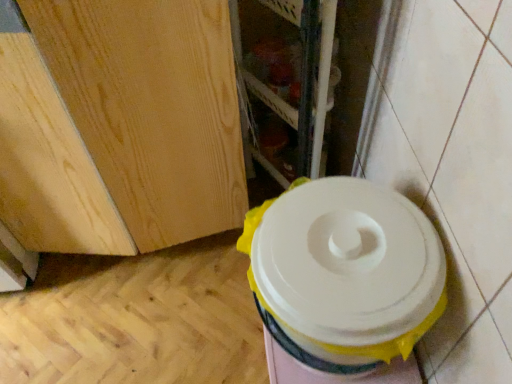
At what (x,y) coordinates should I click in order to perform the action: click on white plastic toilet at lower right. Please return your answer as a coordinate pair (x, y). Image resolution: width=512 pixels, height=384 pixels. Looking at the image, I should click on (343, 282).

What do you see at coordinates (343, 282) in the screenshot?
I see `white plastic toilet at lower right` at bounding box center [343, 282].

Find the location of `wooden shelf at center`. wooden shelf at center is located at coordinates (286, 77).

Measure the distance between point (317,72) and camera.

Point (317,72) and camera are 31.42 inches apart from each other.

This screenshot has width=512, height=384. What do you see at coordinates (286, 77) in the screenshot?
I see `wooden shelf at center` at bounding box center [286, 77].

The image size is (512, 384). I want to click on white plastic toilet at lower right, so click(x=343, y=282).

Does wooden shelf at center appear on the right side of white plastic toilet at lower right?

No, wooden shelf at center is not to the right of white plastic toilet at lower right.

From the picture: Is wooden shelf at center further to camera compared to white plastic toilet at lower right?

Yes, the depth of wooden shelf at center is greater than that of white plastic toilet at lower right.

Which point is more distant from viewer, (283, 124) or (406, 252)?

The point (283, 124) is more distant.

From the image's perspective, is wooden shelf at center above white plastic toilet at lower right?

Yes, from the image's perspective, wooden shelf at center is above white plastic toilet at lower right.

From a real-world perspective, is wooden shelf at center physically located above or below white plastic toilet at lower right?

wooden shelf at center is situated lower than white plastic toilet at lower right in the real world.

Does wooden shelf at center have a lesser width compared to white plastic toilet at lower right?

Indeed, wooden shelf at center has a lesser width compared to white plastic toilet at lower right.

Does wooden shelf at center have a lesser height compared to white plastic toilet at lower right?

No.

Considering the relative sizes of wooden shelf at center and white plastic toilet at lower right in the image provided, is wooden shelf at center bigger than white plastic toilet at lower right?

Yes.

From the picture: Is white plastic toilet at lower right completely or partially inside wooden shelf at center?

No, white plastic toilet at lower right is not inside wooden shelf at center.

Is there a large distance between wooden shelf at center and white plastic toilet at lower right?

No, there isn't a large distance between wooden shelf at center and white plastic toilet at lower right.

Is wooden shelf at center oriented towards white plastic toilet at lower right?

No, wooden shelf at center is not facing towards white plastic toilet at lower right.

The width and height of the screenshot is (512, 384). What are the coordinates of `shelf that appears behind the white plastic toilet at lower right` in the screenshot? It's located at (286, 77).

Which is more to the left, white plastic toilet at lower right or wooden shelf at center?

wooden shelf at center is more to the left.

Considering the positions of objects white plastic toilet at lower right and wooden shelf at center in the image provided, who is behind, white plastic toilet at lower right or wooden shelf at center?

Positioned behind is wooden shelf at center.

Is point (340, 181) less distant than point (303, 42)?

Yes, it is.

From the image's perspective, relative to wooden shelf at center, is white plastic toilet at lower right above or below?

Clearly, from the image's perspective, white plastic toilet at lower right is below wooden shelf at center.

From a real-world perspective, is white plastic toilet at lower right above or below wooden shelf at center?

Clearly, from a real-world perspective, white plastic toilet at lower right is above wooden shelf at center.

Consider the image. Considering the sizes of objects white plastic toilet at lower right and wooden shelf at center in the image provided, who is wider, white plastic toilet at lower right or wooden shelf at center?

Wider between the two is white plastic toilet at lower right.

Is white plastic toilet at lower right taller or shorter than wooden shelf at center?

In the image, white plastic toilet at lower right appears to be shorter than wooden shelf at center.

Is white plastic toilet at lower right bigger than wooden shelf at center?

Actually, white plastic toilet at lower right might be smaller than wooden shelf at center.

Is white plastic toilet at lower right spatially inside wooden shelf at center, or outside of it?

white plastic toilet at lower right is not enclosed by wooden shelf at center.

Would you say white plastic toilet at lower right is a long distance from wooden shelf at center?

No, white plastic toilet at lower right is not far from wooden shelf at center.

Is white plastic toilet at lower right looking in the opposite direction of wooden shelf at center?

white plastic toilet at lower right does not have its back to wooden shelf at center.

How many degrees apart are the facing directions of white plastic toilet at lower right and wooden shelf at center?

29.4 degrees.

In the image, there is a wooden shelf at center. At what (x,y) coordinates should I click in order to perform the action: click on toilet below it (from the image's perspective). Please return your answer as a coordinate pair (x, y). The width and height of the screenshot is (512, 384). Looking at the image, I should click on (343, 282).

Locate an element on the screen. This screenshot has width=512, height=384. shelf below the white plastic toilet at lower right (from a real-world perspective) is located at coordinates (286, 77).

You are a GUI agent. You are given a task and a screenshot of the screen. Output one action in this format:
    pyautogui.click(x=<x>, y=<y>)
    Task: Click on the shelf that is on the left side of white plastic toilet at lower right
    Image resolution: width=512 pixels, height=384 pixels.
    Given the screenshot: What is the action you would take?
    pyautogui.click(x=286, y=77)